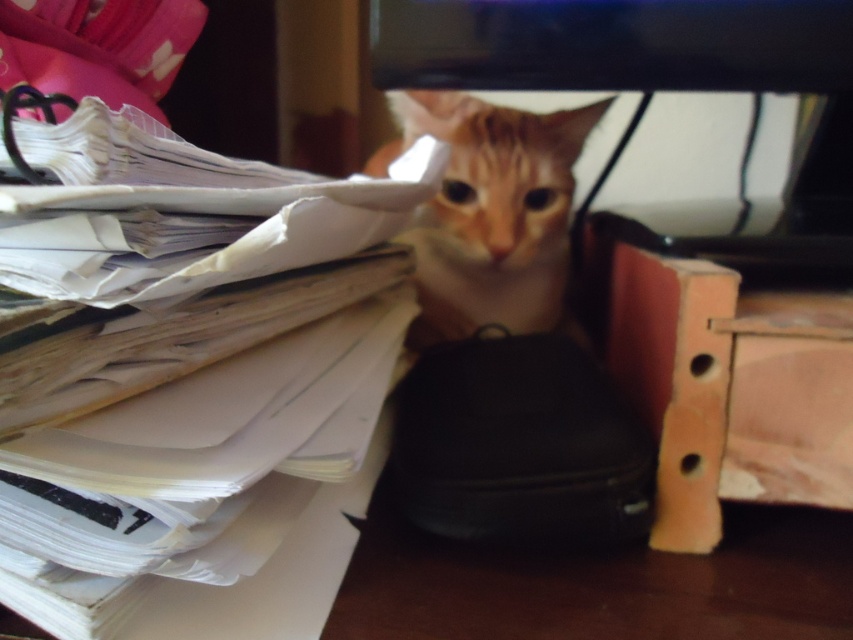
Can you confirm if white paper at left is positioned to the right of black matte bag at center?

Incorrect, white paper at left is not on the right side of black matte bag at center.

Is white paper at left above black matte bag at center?

Yes.

Between point (24, 589) and point (570, 522), which one is positioned in front?

Point (24, 589)

Find the location of a particular element. white paper at left is located at coordinates (196, 400).

Consider the image. Between black matte bag at center and orange fur cat at center, which one has less height?

black matte bag at center is shorter.

Is black matte bag at center further to the viewer compared to orange fur cat at center?

No, black matte bag at center is in front of orange fur cat at center.

What do you see at coordinates (518, 444) in the screenshot?
I see `black matte bag at center` at bounding box center [518, 444].

You are a GUI agent. You are given a task and a screenshot of the screen. Output one action in this format:
    pyautogui.click(x=<x>, y=<y>)
    Task: Click on the black matte bag at center
    This screenshot has width=853, height=640.
    Given the screenshot: What is the action you would take?
    pyautogui.click(x=518, y=444)

Based on the photo, who is positioned more to the left, white paper at left or orange fur cat at center?

white paper at left

Is point (93, 218) in front of point (440, 264)?

Yes, it is.

Who is more distant from viewer, [207,230] or [555,113]?

The point [555,113] is behind.

In order to click on white paper at left in this screenshot , I will do `click(196, 400)`.